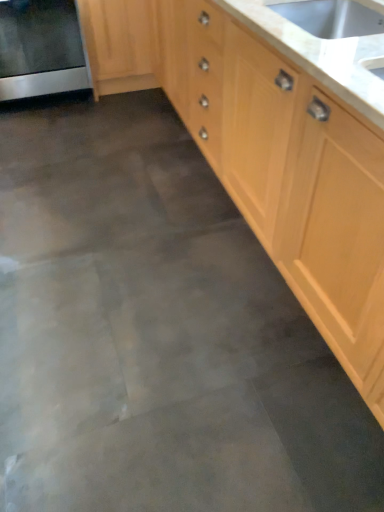
Question: From a real-world perspective, relative to light wood cabinet at center, the second cabinetry when ordered from left to right, is light wood/texture cabinet at upper left, the 1th cabinetry from the left, vertically above or below?

Choices:
 (A) above
 (B) below

Answer: (B)

Question: Considering the positions of light wood/texture cabinet at upper left, the 2th cabinetry from the right, and light wood cabinet at center, the second cabinetry when ordered from left to right, in the image, is light wood/texture cabinet at upper left, the 2th cabinetry from the right, taller or shorter than light wood cabinet at center, the second cabinetry when ordered from left to right,?

Choices:
 (A) short
 (B) tall

Answer: (A)

Question: Which object is the farthest from the light wood/texture cabinet at upper left, the 2th cabinetry from the right?

Choices:
 (A) light wood cabinet at center, positioned as the first cabinetry in right-to-left order
 (B) white marble countertop at upper right
 (C) satin silver oven at left

Answer: (B)

Question: Which is nearer to the satin silver oven at left?

Choices:
 (A) light wood/texture cabinet at upper left, the 2th cabinetry from the right
 (B) light wood cabinet at center, positioned as the first cabinetry in right-to-left order
 (C) white marble countertop at upper right

Answer: (A)